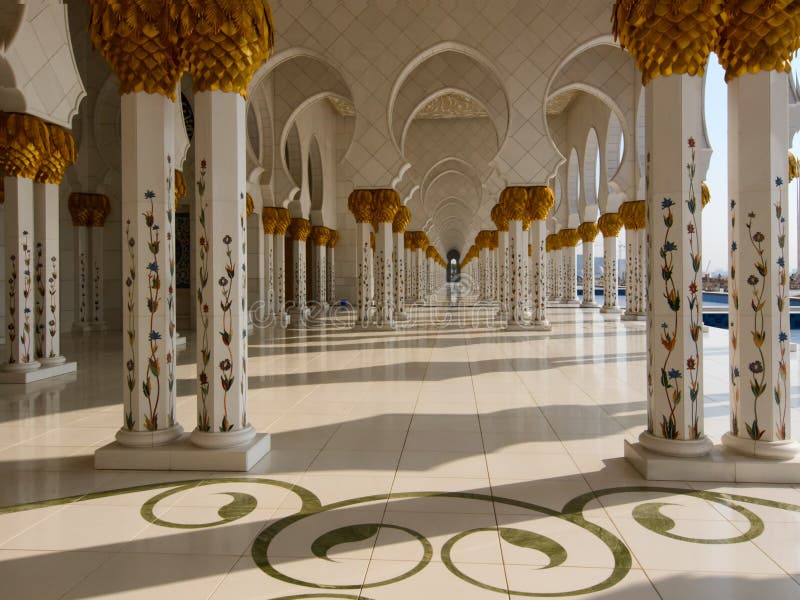
The image size is (800, 600). I want to click on green curving decorations on floor, so click(x=125, y=487), click(x=781, y=504), click(x=302, y=490), click(x=590, y=497), click(x=434, y=495), click(x=330, y=595).